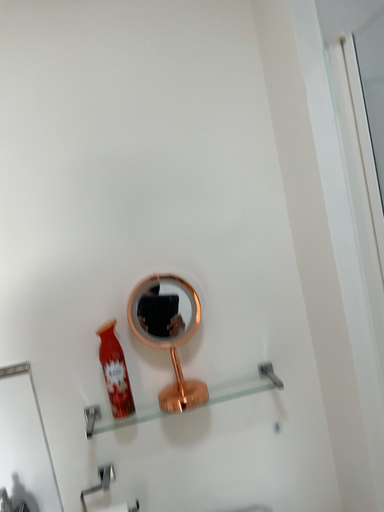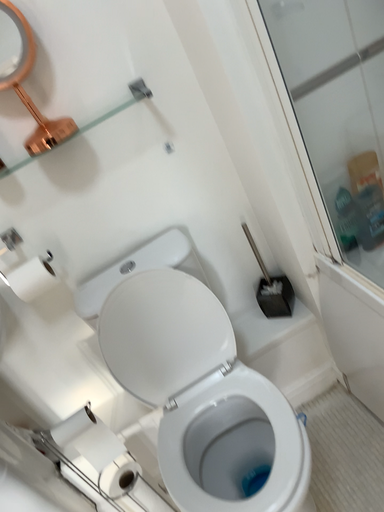
Question: Which way did the camera rotate in the video?

Choices:
 (A) rotated upward
 (B) rotated downward

Answer: (B)